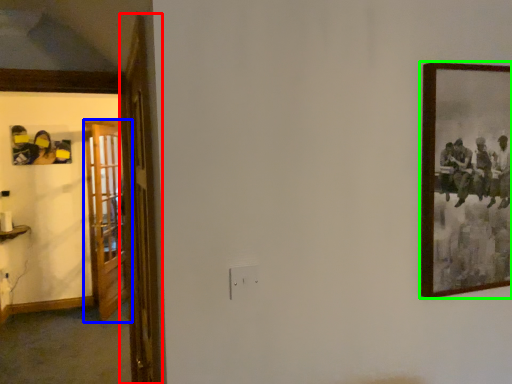
Question: Which object is the farthest from door (highlighted by a red box)? Choose among these: door (highlighted by a blue box) or picture frame (highlighted by a green box).

Choices:
 (A) door
 (B) picture frame

Answer: (A)